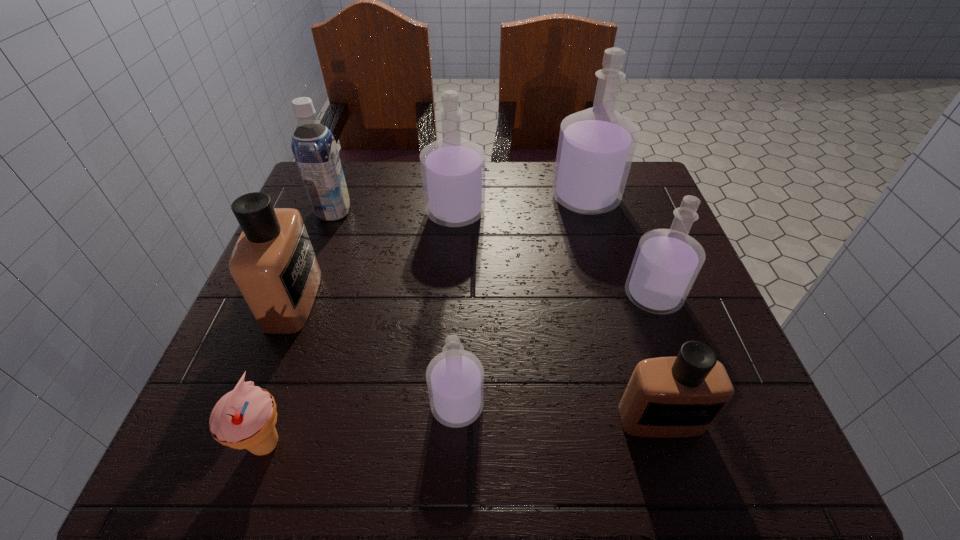
At what (x,y) coordinates should I click in order to perform the action: click on vacant area that lies between the nearer beige perfume and the second nearest purple perfume. Please return your answer as a coordinate pair (x, y). The height and width of the screenshot is (540, 960). Looking at the image, I should click on (657, 357).

Image resolution: width=960 pixels, height=540 pixels. Identify the location of free space that is in between the biggest purple perfume and the second biggest purple perfume. coord(520,205).

Locate an element on the screen. This screenshot has height=540, width=960. the sixth closest object to the second nearest purple perfume is located at coordinates (273, 264).

Locate an element on the screen. Image resolution: width=960 pixels, height=540 pixels. object that ranks as the closest to the biggest purple perfume is located at coordinates (453, 169).

Where is `perfume that is the fourth closest one to the second nearest purple perfume`? This screenshot has height=540, width=960. perfume that is the fourth closest one to the second nearest purple perfume is located at coordinates (455, 378).

Where is `perfume that is the third closest one to the smallest purple perfume`? Image resolution: width=960 pixels, height=540 pixels. perfume that is the third closest one to the smallest purple perfume is located at coordinates (667, 262).

At what (x,y) coordinates should I click in order to perform the action: click on purple perfume that can be found as the second closest to the second nearest purple perfume. Please return your answer as a coordinate pair (x, y). The width and height of the screenshot is (960, 540). Looking at the image, I should click on (453, 169).

Where is `purple perfume that is the closest to the nearest purple perfume`? The width and height of the screenshot is (960, 540). purple perfume that is the closest to the nearest purple perfume is located at coordinates (667, 262).

Locate an element on the screen. vacant space that satisfies the following two spatial constraints: 1. on the front label of the icecream; 2. on the left side of the left beige perfume is located at coordinates (237, 444).

Where is `free space that satisfies the following two spatial constraints: 1. on the front label of the smallest purple perfume; 2. on the left side of the bigger beige perfume`? This screenshot has width=960, height=540. free space that satisfies the following two spatial constraints: 1. on the front label of the smallest purple perfume; 2. on the left side of the bigger beige perfume is located at coordinates pos(252,405).